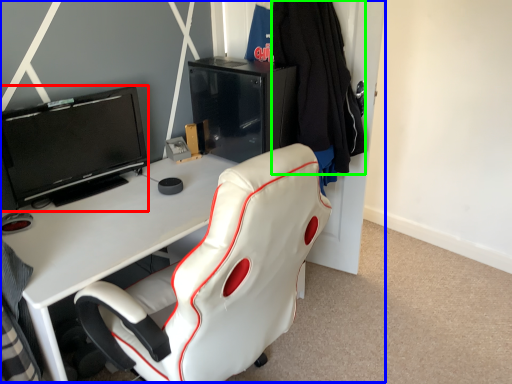
Question: Based on their relative distances, which object is farther from television (highlighted by a red box)? Choose from entertainment center (highlighted by a blue box) and clothing (highlighted by a green box).

Choices:
 (A) entertainment center
 (B) clothing

Answer: (A)